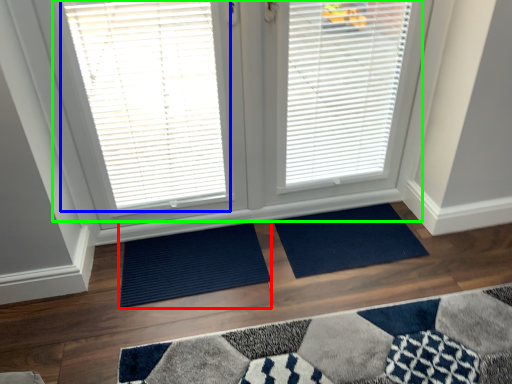
Question: Based on their relative distances, which object is nearer to doormat (highlighted by a red box)? Choose from window blind (highlighted by a blue box) and bay window (highlighted by a green box).

Choices:
 (A) window blind
 (B) bay window

Answer: (B)